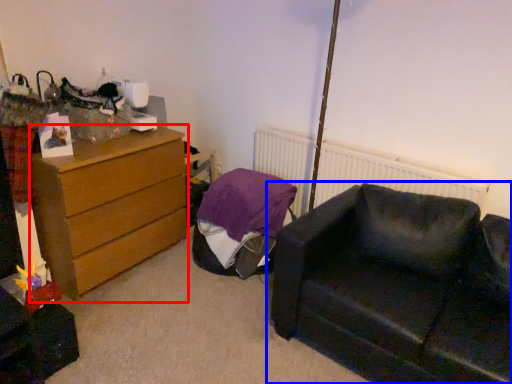
Question: Which point is further to the camera, chest of drawers (highlighted by a red box) or studio couch (highlighted by a blue box)?

Choices:
 (A) chest of drawers
 (B) studio couch

Answer: (A)